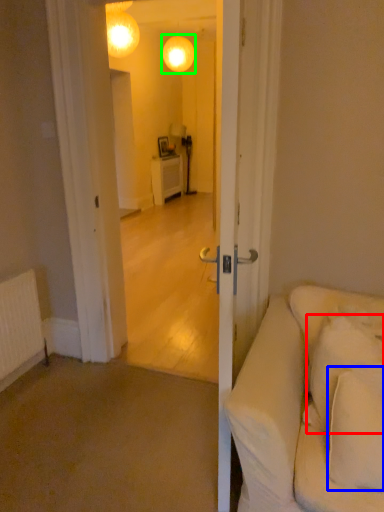
Question: Based on their relative distances, which object is nearer to pillow (highlighted by a red box)? Choose from pillow (highlighted by a blue box) and lamp (highlighted by a green box).

Choices:
 (A) pillow
 (B) lamp

Answer: (A)